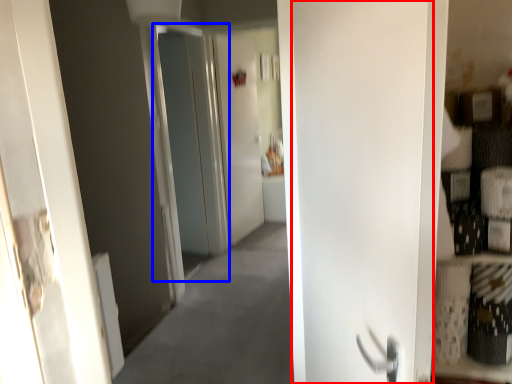
Question: Which object appears farthest to the camera in this image, door (highlighted by a red box) or screen door (highlighted by a blue box)?

Choices:
 (A) door
 (B) screen door

Answer: (B)